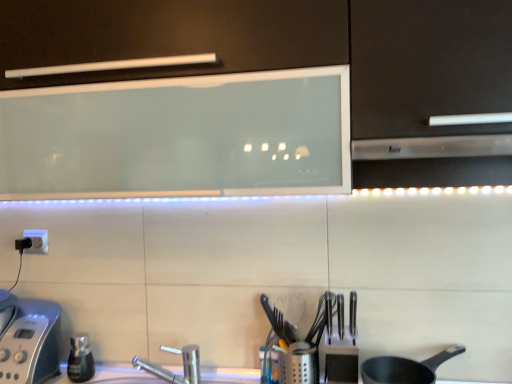
Identify the location of silver metallic toaster at lower left, the 2th appliance from the right. The height and width of the screenshot is (384, 512). (28, 339).

What is the approximate width of satin silver exhaust hood at right?

12.98 inches.

Describe the element at coordinates (121, 374) in the screenshot. Image resolution: width=512 pixels, height=384 pixels. I see `white glossy countertop at center` at that location.

The height and width of the screenshot is (384, 512). What are the coordinates of `white glossy countertop at center` in the screenshot? It's located at (121, 374).

Describe the element at coordinates (297, 363) in the screenshot. The image size is (512, 384). I see `metallic silver utensil holder at center, acting as the 1th appliance starting from the right` at that location.

Locate an element on the screen. The image size is (512, 384). metallic silver utensil holder at center, the second appliance when ordered from left to right is located at coordinates (297, 363).

Where is `silver metallic toaster at lower left, positioned as the 1th appliance in left-to-right order`? Image resolution: width=512 pixels, height=384 pixels. silver metallic toaster at lower left, positioned as the 1th appliance in left-to-right order is located at coordinates (28, 339).

Considering the sizes of objects metallic silver utensil holder at center, the second appliance when ordered from left to right, and matte black frying pan at lower right in the image provided, who is taller, metallic silver utensil holder at center, the second appliance when ordered from left to right, or matte black frying pan at lower right?

Standing taller between the two is metallic silver utensil holder at center, the second appliance when ordered from left to right.

Is metallic silver utensil holder at center, the second appliance when ordered from left to right, to the left or to the right of matte black frying pan at lower right in the image?

metallic silver utensil holder at center, the second appliance when ordered from left to right, is positioned on matte black frying pan at lower right's left side.

Could matte black frying pan at lower right be considered to be inside metallic silver utensil holder at center, the second appliance when ordered from left to right?

That's incorrect, matte black frying pan at lower right is not inside metallic silver utensil holder at center, the second appliance when ordered from left to right.

In the scene shown: Does metallic silver utensil holder at center, acting as the 1th appliance starting from the right, have a larger size compared to matte black frying pan at lower right?

No, metallic silver utensil holder at center, acting as the 1th appliance starting from the right, is not bigger than matte black frying pan at lower right.

Consider the image. Are satin silver exhaust hood at right and silver metallic toaster at lower left, positioned as the 1th appliance in left-to-right order, located far from each other?

Yes, satin silver exhaust hood at right is far from silver metallic toaster at lower left, positioned as the 1th appliance in left-to-right order.

Which of these two, satin silver exhaust hood at right or silver metallic toaster at lower left, the 2th appliance from the right, stands taller?

Standing taller between the two is silver metallic toaster at lower left, the 2th appliance from the right.

From the image's perspective, which one is positioned lower, satin silver exhaust hood at right or silver metallic toaster at lower left, the 2th appliance from the right?

silver metallic toaster at lower left, the 2th appliance from the right, is shown below in the image.

In terms of width, does matte black frying pan at lower right look wider or thinner when compared to silver metallic toaster at lower left, positioned as the 1th appliance in left-to-right order?

In the image, matte black frying pan at lower right appears to be more narrow than silver metallic toaster at lower left, positioned as the 1th appliance in left-to-right order.

Considering the sizes of objects matte black frying pan at lower right and silver metallic toaster at lower left, the 2th appliance from the right, in the image provided, who is bigger, matte black frying pan at lower right or silver metallic toaster at lower left, the 2th appliance from the right,?

silver metallic toaster at lower left, the 2th appliance from the right.

From a real-world perspective, relative to silver metallic toaster at lower left, the 2th appliance from the right, is matte black frying pan at lower right vertically above or below?

matte black frying pan at lower right is situated lower than silver metallic toaster at lower left, the 2th appliance from the right, in the real world.

Considering the relative sizes of satin silver exhaust hood at right and silver metallic faucet at lower center in the image provided, is satin silver exhaust hood at right smaller than silver metallic faucet at lower center?

No.

Can you tell me how much satin silver exhaust hood at right and silver metallic faucet at lower center differ in facing direction?

The facing directions of satin silver exhaust hood at right and silver metallic faucet at lower center are 49.9 degrees apart.

Is satin silver exhaust hood at right positioned far away from silver metallic faucet at lower center?

Actually, satin silver exhaust hood at right and silver metallic faucet at lower center are a little close together.

Considering the points (371, 158) and (136, 356), which point is in front, point (371, 158) or point (136, 356)?

The point (371, 158) is more forward.

From a real-world perspective, which is physically above, polished metal knives at center or matte black frying pan at lower right?

In real-world perspective, polished metal knives at center is above.

Does polished metal knives at center have a smaller size compared to matte black frying pan at lower right?

Yes, polished metal knives at center is smaller than matte black frying pan at lower right.

Is the depth of polished metal knives at center greater than that of matte black frying pan at lower right?

Yes, it is.

Would you say polished metal knives at center is a long distance from matte black frying pan at lower right?

No, polished metal knives at center is not far away from matte black frying pan at lower right.

Considering the sizes of metallic silver utensil holder at center, acting as the 1th appliance starting from the right, and silver metallic faucet at lower center in the image, is metallic silver utensil holder at center, acting as the 1th appliance starting from the right, taller or shorter than silver metallic faucet at lower center?

Clearly, metallic silver utensil holder at center, acting as the 1th appliance starting from the right, is shorter compared to silver metallic faucet at lower center.

Which is more to the left, metallic silver utensil holder at center, acting as the 1th appliance starting from the right, or silver metallic faucet at lower center?

silver metallic faucet at lower center is more to the left.

Considering the points (281, 351) and (195, 360), which point is behind, point (281, 351) or point (195, 360)?

The point (195, 360) is farther.

Is white glossy countertop at center thinner than metallic silver utensil holder at center, acting as the 1th appliance starting from the right?

In fact, white glossy countertop at center might be wider than metallic silver utensil holder at center, acting as the 1th appliance starting from the right.

Is white glossy countertop at center looking in the opposite direction of metallic silver utensil holder at center, acting as the 1th appliance starting from the right?

No, white glossy countertop at center is not facing the opposite direction of metallic silver utensil holder at center, acting as the 1th appliance starting from the right.

From the image's perspective, is white glossy countertop at center beneath metallic silver utensil holder at center, acting as the 1th appliance starting from the right?

Correct, white glossy countertop at center appears lower than metallic silver utensil holder at center, acting as the 1th appliance starting from the right, in the image.

Locate an element on the screen. This screenshot has width=512, height=384. appliance located below the matte black frying pan at lower right (from the image's perspective) is located at coordinates (297, 363).

You are a GUI agent. You are given a task and a screenshot of the screen. Output one action in this format:
    pyautogui.click(x=<x>, y=<y>)
    Task: Click on the 1st appliance behind the satin silver exhaust hood at right
    
    Given the screenshot: What is the action you would take?
    pyautogui.click(x=28, y=339)

Based on their spatial positions, is white glossy countertop at center or metallic silver utensil holder at center, acting as the 1th appliance starting from the right, further from satin silver exhaust hood at right?

The object further to satin silver exhaust hood at right is white glossy countertop at center.

From the image, which object appears to be farther from silver metallic faucet at lower center, silver metallic toaster at lower left, positioned as the 1th appliance in left-to-right order, or satin silver exhaust hood at right?

satin silver exhaust hood at right lies further to silver metallic faucet at lower center than the other object.

Estimate the real-world distances between objects in this image. Which object is further from metallic silver utensil holder at center, the second appliance when ordered from left to right, silver metallic toaster at lower left, positioned as the 1th appliance in left-to-right order, or satin silver exhaust hood at right?

silver metallic toaster at lower left, positioned as the 1th appliance in left-to-right order, is further to metallic silver utensil holder at center, the second appliance when ordered from left to right.

Which object lies further to the anchor point satin silver exhaust hood at right, polished metal knives at center or metallic silver utensil holder at center, acting as the 1th appliance starting from the right?

Among the two, metallic silver utensil holder at center, acting as the 1th appliance starting from the right, is located further to satin silver exhaust hood at right.

Considering their positions, is white glossy countertop at center positioned closer to metallic silver utensil holder at center, acting as the 1th appliance starting from the right, than polished metal knives at center?

polished metal knives at center lies closer to metallic silver utensil holder at center, acting as the 1th appliance starting from the right, than the other object.

Which object lies nearer to the anchor point metallic silver utensil holder at center, the second appliance when ordered from left to right, polished metal knives at center or white glossy countertop at center?

Among the two, polished metal knives at center is located nearer to metallic silver utensil holder at center, the second appliance when ordered from left to right.

Based on their spatial positions, is white glossy countertop at center or polished metal knives at center further from silver metallic faucet at lower center?

The object further to silver metallic faucet at lower center is polished metal knives at center.

Estimate the real-world distances between objects in this image. Which object is further from metallic silver utensil holder at center, the second appliance when ordered from left to right, white glossy countertop at center or matte black frying pan at lower right?

white glossy countertop at center.

This screenshot has height=384, width=512. Identify the location of appliance between silver metallic toaster at lower left, the 2th appliance from the right, and polished metal knives at center. (297, 363).

The width and height of the screenshot is (512, 384). Find the location of `appliance between white glossy countertop at center and polished metal knives at center from left to right`. appliance between white glossy countertop at center and polished metal knives at center from left to right is located at coordinates (297, 363).

The image size is (512, 384). Find the location of `tap between silver metallic toaster at lower left, positioned as the 1th appliance in left-to-right order, and white glossy countertop at center, in the horizontal direction`. tap between silver metallic toaster at lower left, positioned as the 1th appliance in left-to-right order, and white glossy countertop at center, in the horizontal direction is located at coordinates (183, 365).

Identify the location of counter top situated between silver metallic toaster at lower left, the 2th appliance from the right, and matte black frying pan at lower right from left to right. The image size is (512, 384). (121, 374).